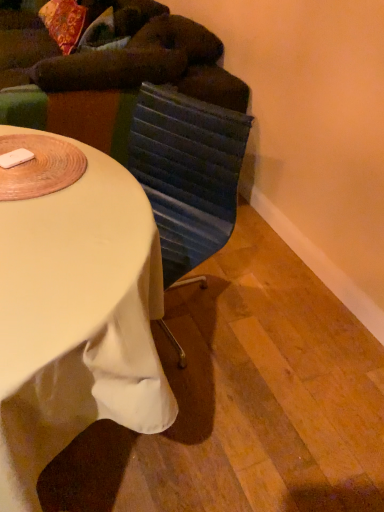
The height and width of the screenshot is (512, 384). I want to click on vacant space that is in between white fabric-covered desk at center and textured blue swivel chair at center, so click(205, 397).